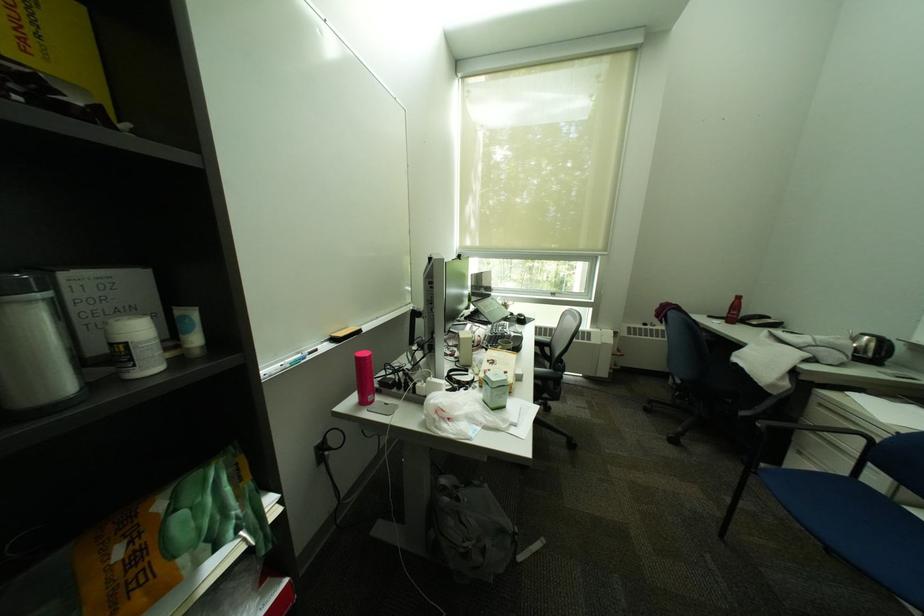
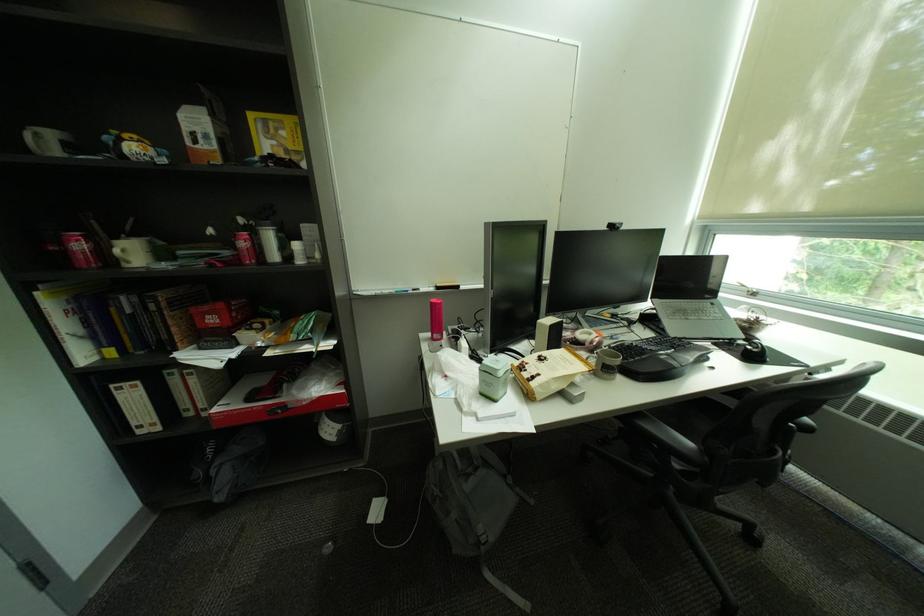
In the second image, find the point that corresponds to point 470,257 in the first image.

(621, 227)